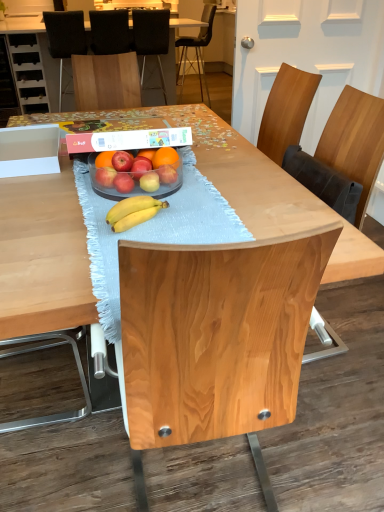
Locate an element on the screen. This screenshot has height=512, width=384. vacant space in front of matte red apple at center, placed as the 2th apple when sorted from right to left is located at coordinates (161, 216).